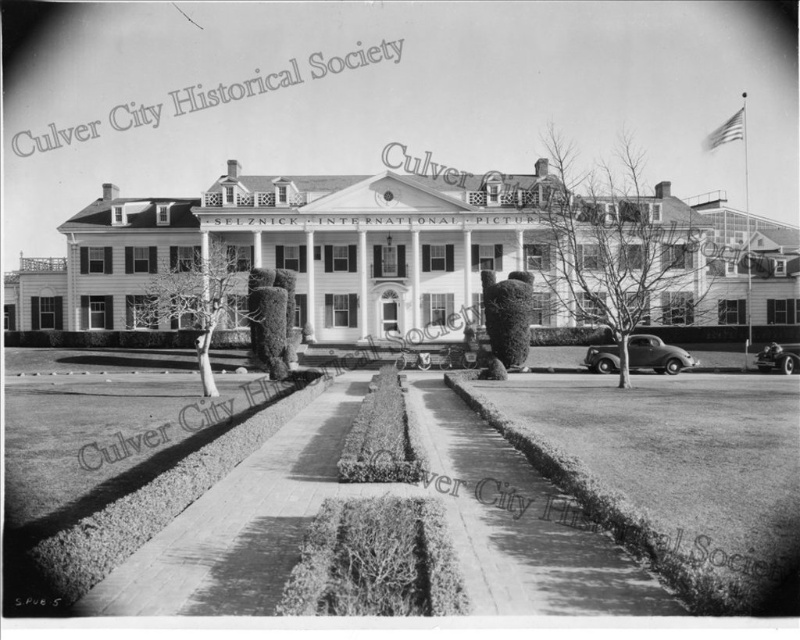
How far apart are shiny silver sedan at center and shiny chrome car at lower right?

shiny silver sedan at center is 16.01 meters from shiny chrome car at lower right.

Does shiny silver sedan at center have a greater width compared to shiny chrome car at lower right?

Yes, shiny silver sedan at center is wider than shiny chrome car at lower right.

Is point (637, 369) positioned behind point (768, 344)?

No.

Find the location of a particular element. shiny silver sedan at center is located at coordinates (656, 355).